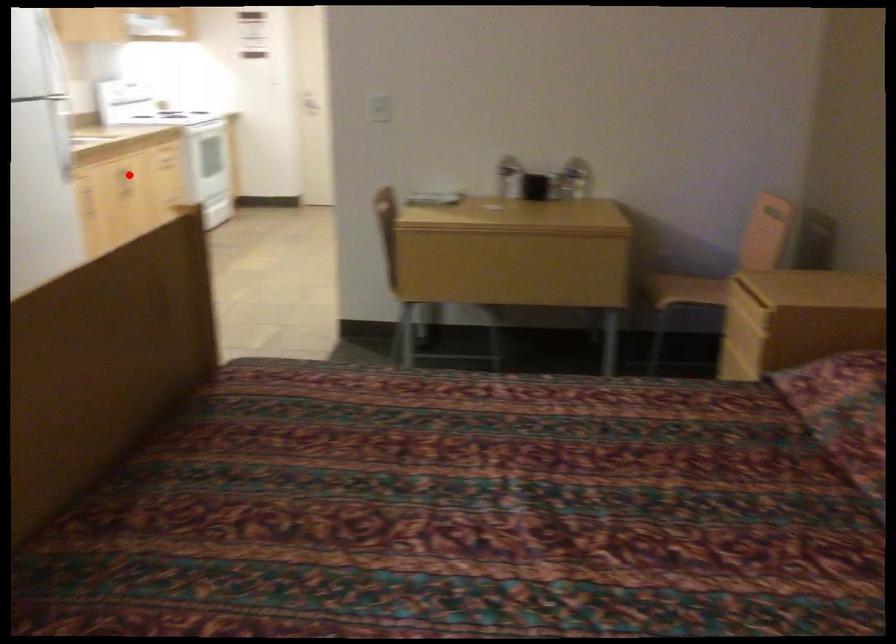
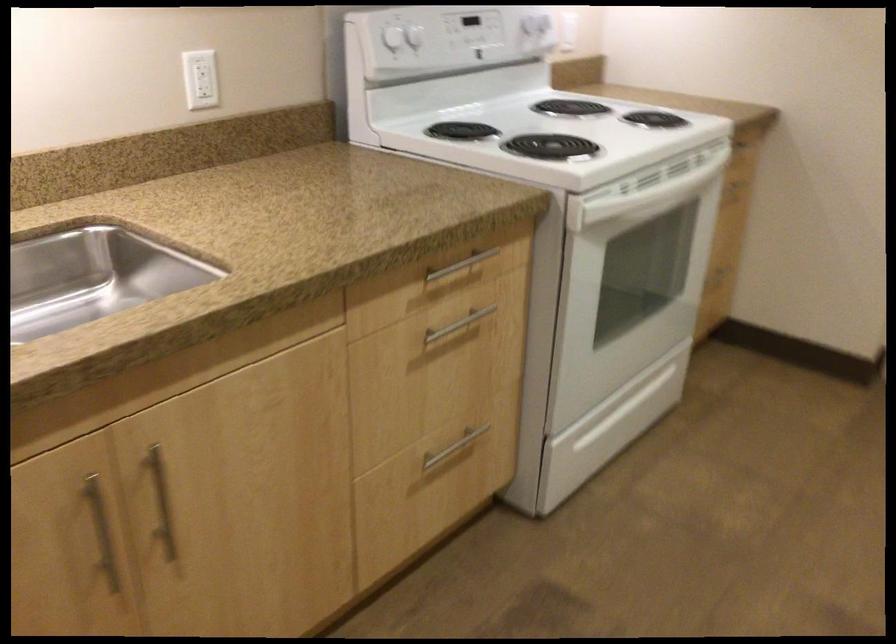
Locate, in the second image, the point that corresponds to the highlighted location in the first image.

(161, 502)